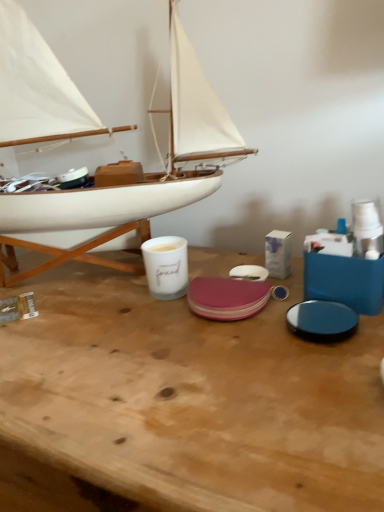
Identify the location of free space in front of white ceramic mug at center. (160, 351).